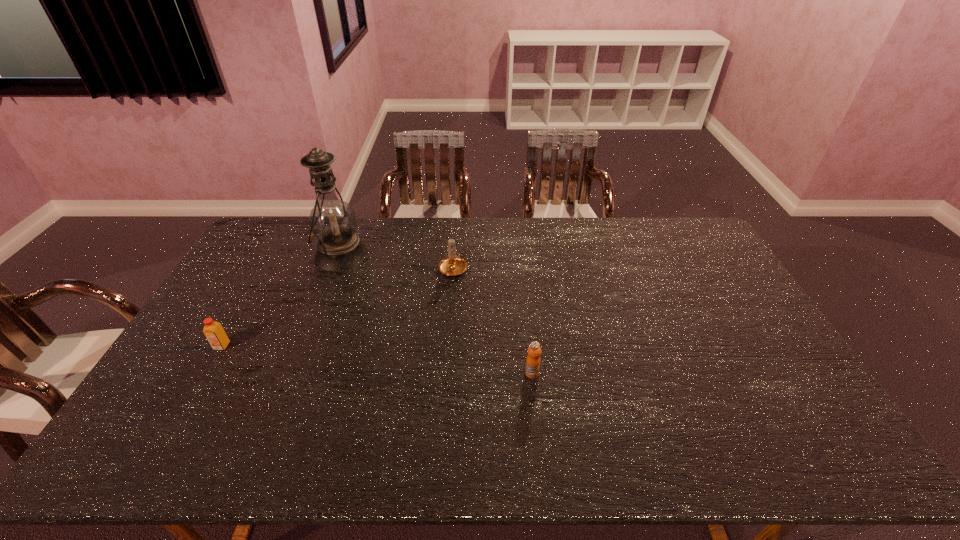
This screenshot has height=540, width=960. Identify the location of free space between the second object from right to left and the second nearest object. (338, 307).

This screenshot has height=540, width=960. What are the coordinates of `free space between the oil lamp and the candle` in the screenshot? It's located at (397, 261).

Identify the location of empty space between the candle and the oil lamp. The width and height of the screenshot is (960, 540). (397, 261).

The image size is (960, 540). Identify the location of blank region between the third object from right to left and the leftmost object. (282, 300).

At what (x,y) coordinates should I click in order to perform the action: click on free space between the second object from right to left and the nearest object. Please return your answer as a coordinate pair (x, y). Looking at the image, I should click on (492, 320).

The height and width of the screenshot is (540, 960). I want to click on blank region between the tallest object and the leftmost object, so click(x=282, y=300).

The height and width of the screenshot is (540, 960). What are the coordinates of `free space between the tallest object and the candle` in the screenshot? It's located at (397, 261).

Identify the location of vacant area between the candle and the nearest object. (492, 320).

You are a GUI agent. You are given a task and a screenshot of the screen. Output one action in this format:
    pyautogui.click(x=<x>, y=<y>)
    Task: Click on the empty location between the rightmost object and the leftmost object
    The image size is (960, 540).
    Given the screenshot: What is the action you would take?
    pyautogui.click(x=377, y=360)

The image size is (960, 540). I want to click on free point between the tallest object and the nearest object, so click(x=437, y=314).